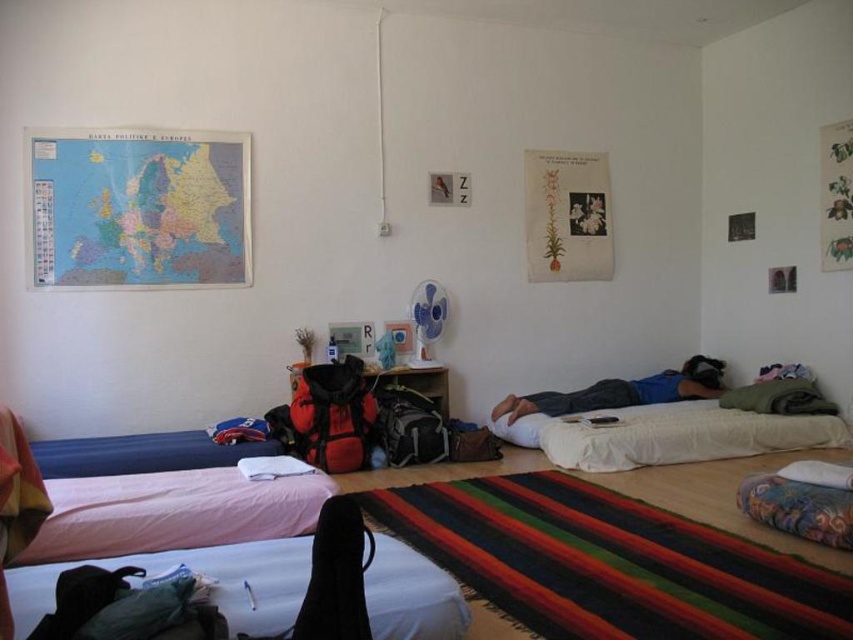
Does point (248, 577) lie behind point (674, 404)?

No, it is not.

Who is taller, pink fabric bed at lower left or white soft bed at lower right?

pink fabric bed at lower left is taller.

What are the coordinates of `pink fabric bed at lower left` in the screenshot? It's located at (242, 579).

Where is `pink fabric bed at lower left`? This screenshot has width=853, height=640. pink fabric bed at lower left is located at coordinates (242, 579).

Which is in front, point (41, 570) or point (648, 385)?

Point (41, 570)

Can you confirm if pink fabric bed at lower left is positioned above blue cotton shirt at center?

No, pink fabric bed at lower left is not above blue cotton shirt at center.

Is point (270, 541) in front of point (712, 364)?

Yes, it is.

What are the coordinates of `pink fabric bed at lower left` in the screenshot? It's located at (242, 579).

Between white soft bed at lower right and blue cotton shirt at center, which one has more height?

white soft bed at lower right is taller.

Does point (665, 461) come closer to viewer compared to point (572, 410)?

Yes, it is.

Identify the location of white soft bed at lower right. The image size is (853, 640). (668, 435).